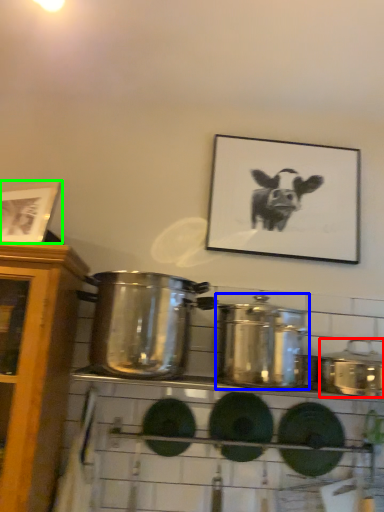
Question: Which is nearer to the crock pot (highlighted by a red box)? crock pot (highlighted by a blue box) or picture frame (highlighted by a green box).

Choices:
 (A) crock pot
 (B) picture frame

Answer: (A)